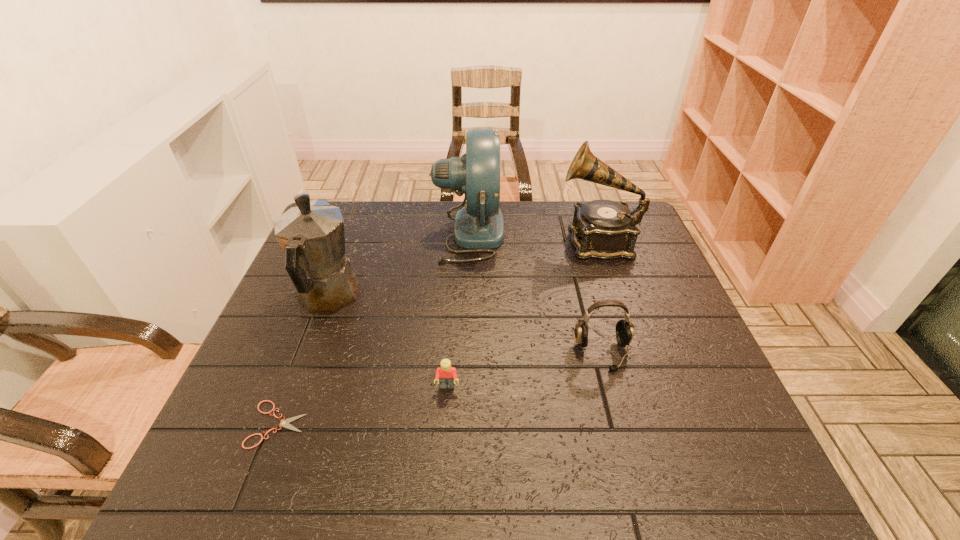
Point out which object is positioned as the fifth nearest to the coffeepot. Please provide its 2D coordinates. Your answer should be formatted as a tuple, i.e. [(x, y)], where the tuple contains the x and y coordinates of a point satisfying the conditions above.

[(604, 229)]

The image size is (960, 540). What are the coordinates of `vacant space that satisfies the following two spatial constraints: 1. on the horn of the phonograph record; 2. with the microphone on the side of the fourth tallest object` in the screenshot? It's located at (636, 353).